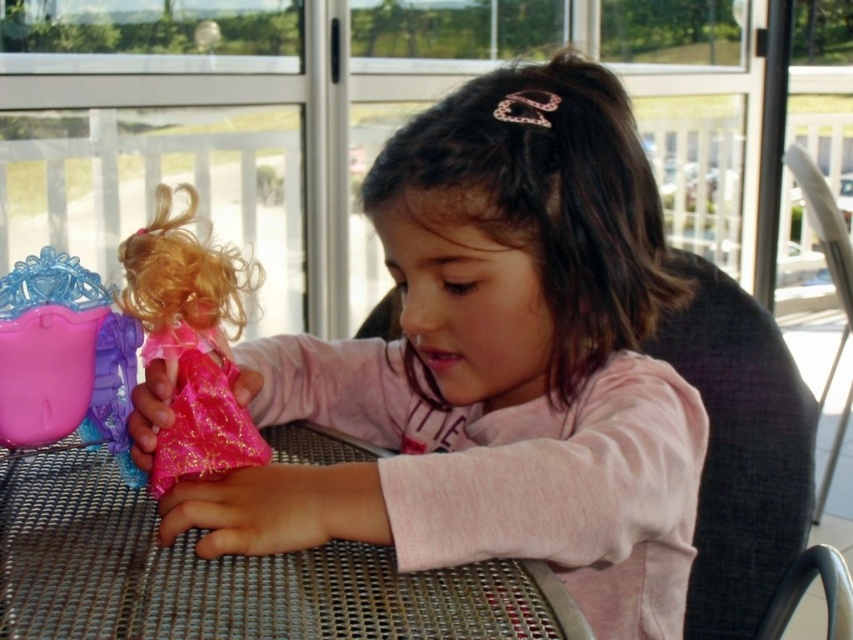
Does pink glitter doll at center have a greater width compared to pink plastic tiara at left?

Yes.

Can you confirm if pink glitter doll at center is positioned to the left of pink plastic tiara at left?

In fact, pink glitter doll at center is to the right of pink plastic tiara at left.

I want to click on pink glitter doll at center, so click(x=495, y=364).

Is point (166, 593) behind point (828, 588)?

No, it is not.

Who is more distant from viewer, [509,595] or [776,618]?

The point [776,618] is behind.

Which is behind, point (465, 612) or point (825, 584)?

The point (825, 584) is behind.

You are a GUI agent. You are given a task and a screenshot of the screen. Output one action in this format:
    pyautogui.click(x=<x>, y=<y>)
    Task: Click on the metallic mesh table at center
    The image size is (853, 640).
    Given the screenshot: What is the action you would take?
    pyautogui.click(x=230, y=577)

Who is positioned more to the right, shiny pink fabric doll at center or pink plastic tiara at left?

From the viewer's perspective, shiny pink fabric doll at center appears more on the right side.

Does point (157, 465) lie behind point (74, 349)?

No, (157, 465) is closer to viewer.

Is point (253, 458) positioned behind point (32, 344)?

No, it is in front of (32, 344).

Locate an element on the screen. shiny pink fabric doll at center is located at coordinates (190, 340).